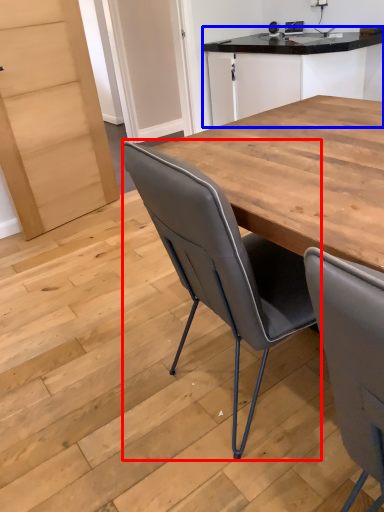
Question: Which object appears farthest to the camera in this image, chair (highlighted by a red box) or cabinetry (highlighted by a blue box)?

Choices:
 (A) chair
 (B) cabinetry

Answer: (B)